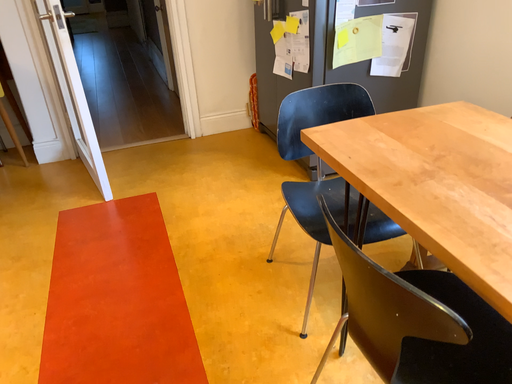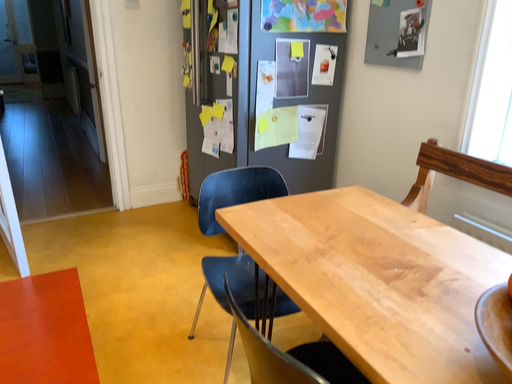
Question: Which way did the camera rotate in the video?

Choices:
 (A) rotated right
 (B) rotated left

Answer: (A)